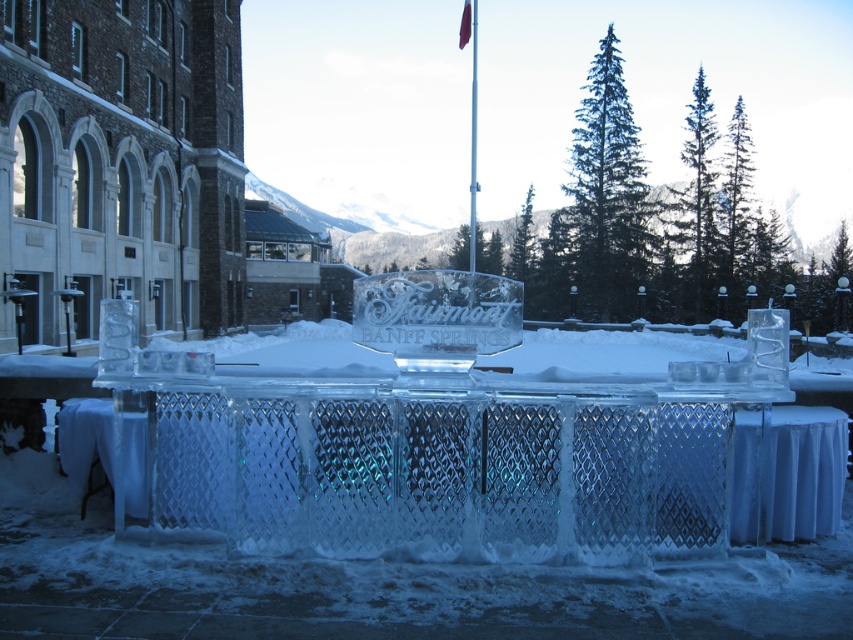
Question: Among these objects, which one is nearest to the camera?

Choices:
 (A) green needle-like tree at upper center
 (B) metallic flag pole at center

Answer: (B)

Question: Among these objects, which one is nearest to the camera?

Choices:
 (A) green needle-like tree at upper center
 (B) metallic flag pole at center
 (C) clear ice table at center

Answer: (B)

Question: Can you confirm if green needle-like tree at upper center is positioned above clear ice table at center?

Choices:
 (A) no
 (B) yes

Answer: (B)

Question: Does green needle-like tree at upper center appear on the right side of metallic flag pole at center?

Choices:
 (A) no
 (B) yes

Answer: (B)

Question: Does green needle-like tree at upper center have a lesser width compared to metallic flag pole at center?

Choices:
 (A) yes
 (B) no

Answer: (B)

Question: Which point is farther to the camera?

Choices:
 (A) metallic flag pole at center
 (B) clear ice table at center
 (C) green needle-like tree at upper center

Answer: (C)